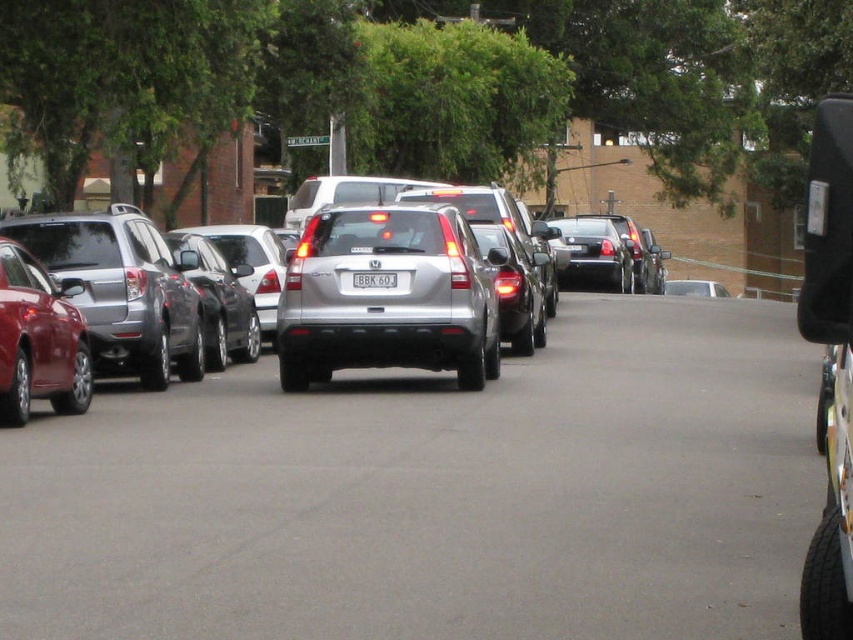
What do you see at coordinates (109, 282) in the screenshot? I see `silver metallic suv at center` at bounding box center [109, 282].

Is point (229, 266) farther from camera compared to point (428, 284)?

Yes, it is.

You are a GUI agent. You are given a task and a screenshot of the screen. Output one action in this format:
    pyautogui.click(x=<x>, y=<y>)
    Task: Click on the silver metallic suv at center
    
    Given the screenshot: What is the action you would take?
    pyautogui.click(x=109, y=282)

Is point (25, 282) positioned in front of point (39, 268)?

Yes, it is.

Is point (109, 280) farther from viewer compared to point (82, 353)?

Yes, it is behind point (82, 353).

In order to click on silver metallic suv at center in this screenshot , I will do `click(109, 282)`.

Is shiny red sedan at left to the right of white plastic license plate at center from the viewer's perspective?

No, shiny red sedan at left is not to the right of white plastic license plate at center.

Who is positioned more to the left, shiny red sedan at left or white plastic license plate at center?

From the viewer's perspective, shiny red sedan at left appears more on the left side.

Is point (19, 262) positioned behind point (386, 276)?

No, it is in front of (386, 276).

At what (x,y) coordinates should I click in order to perform the action: click on shiny red sedan at left. Please return your answer as a coordinate pair (x, y). The width and height of the screenshot is (853, 640). Looking at the image, I should click on (39, 340).